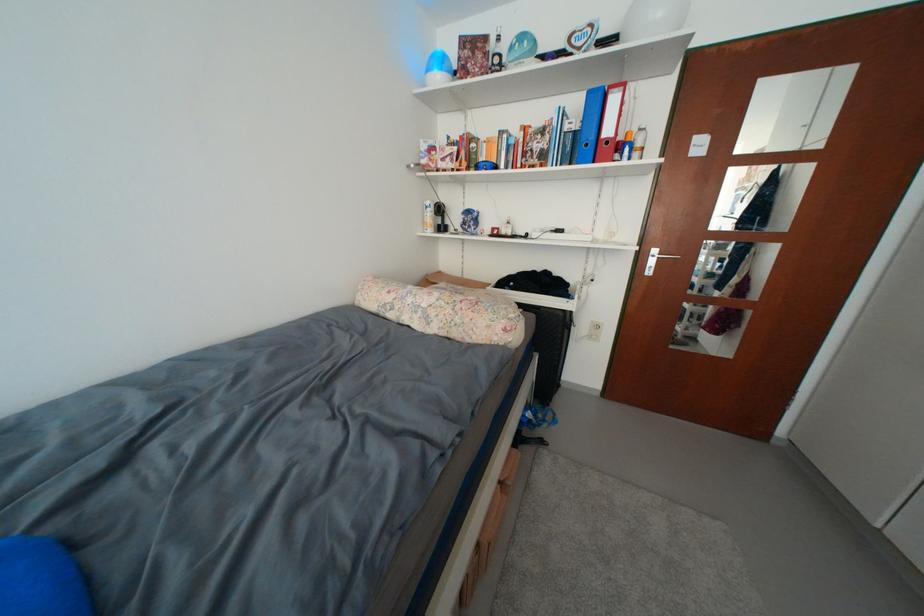
You are a GUI agent. You are given a task and a screenshot of the screen. Output one action in this format:
    pyautogui.click(x=<x>, y=<y>)
    Task: Click on the red binder
    
    Given the screenshot: What is the action you would take?
    pyautogui.click(x=610, y=122)